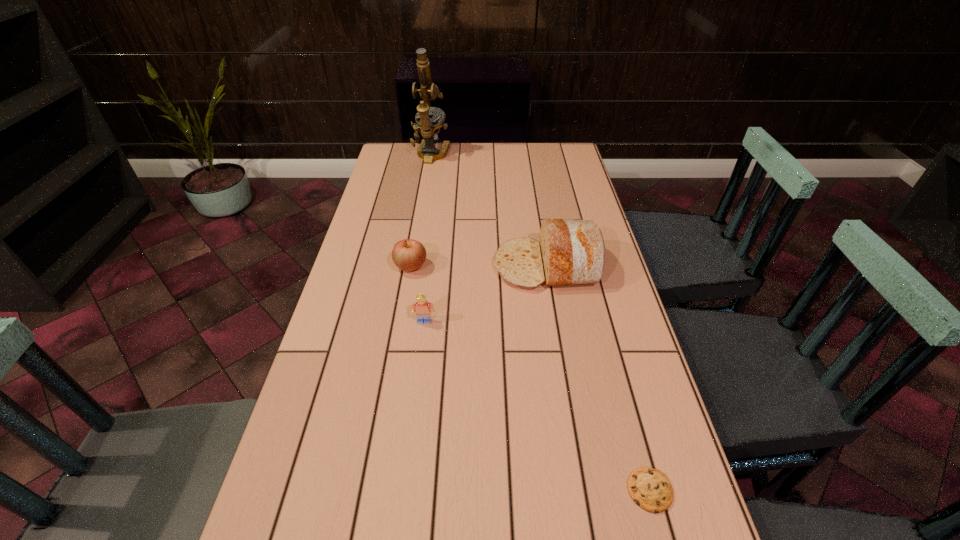
The width and height of the screenshot is (960, 540). Identify the location of vacant point located at the sliced end of the second tallest object. (399, 266).

Identify the location of free space located on the front of the apple. The image size is (960, 540). (402, 320).

The height and width of the screenshot is (540, 960). I want to click on vacant space located on the front-facing side of the Lego, so click(x=408, y=453).

Where is `free spot located on the left of the shortest object`? This screenshot has width=960, height=540. free spot located on the left of the shortest object is located at coordinates (575, 490).

At what (x,y) coordinates should I click in order to perform the action: click on object that is at the far edge. Please return your answer as a coordinate pair (x, y). The height and width of the screenshot is (540, 960). Looking at the image, I should click on (430, 127).

Image resolution: width=960 pixels, height=540 pixels. In order to click on microscope situated at the left edge in this screenshot , I will do `click(430, 127)`.

Where is `apple that is at the left edge`? Image resolution: width=960 pixels, height=540 pixels. apple that is at the left edge is located at coordinates (408, 255).

The width and height of the screenshot is (960, 540). In order to click on bread located at the right edge in this screenshot , I will do `click(571, 252)`.

Find the location of a particular element. Image resolution: width=960 pixels, height=540 pixels. cookie at the right edge is located at coordinates (650, 489).

Where is `object present at the far left corner`? This screenshot has height=540, width=960. object present at the far left corner is located at coordinates (430, 127).